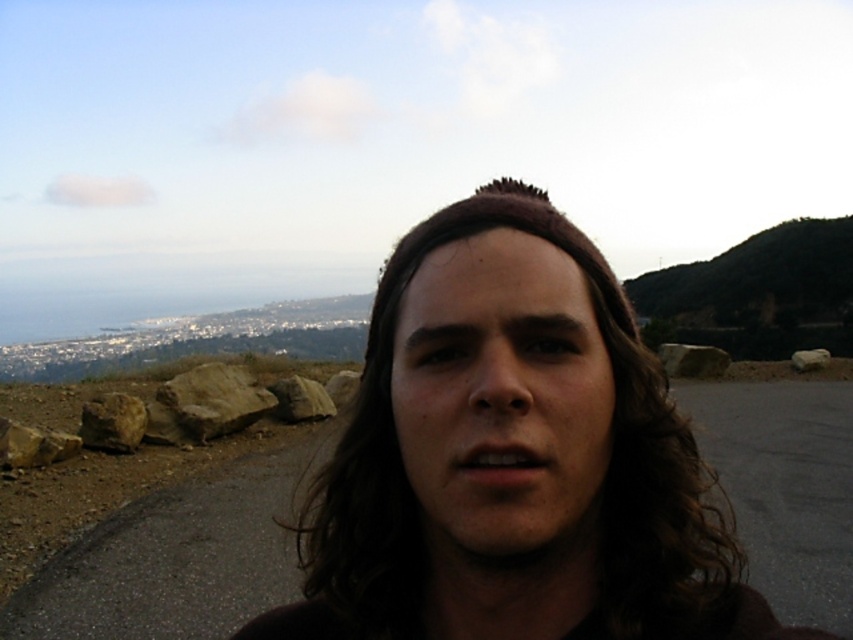
Question: Which of the following is the closest to the observer?

Choices:
 (A) brown rough rock at center
 (B) dirt road at center

Answer: (B)

Question: Is dirt road at center thinner than gray rough rock at right?

Choices:
 (A) yes
 (B) no

Answer: (B)

Question: Which object appears closest to the camera in this image?

Choices:
 (A) brown rough rock at center
 (B) gray rough rock at right
 (C) brown rough rock at lower left
 (D) gray rock at right

Answer: (C)

Question: Observing the image, what is the correct spatial positioning of rough textured rock at left in reference to gray rock at center?

Choices:
 (A) above
 (B) below

Answer: (A)

Question: Does dark green forested hill at upper right appear under brown rough rock at lower left?

Choices:
 (A) yes
 (B) no

Answer: (B)

Question: Among these objects, which one is nearest to the camera?

Choices:
 (A) brown rough rock at center
 (B) dark green forested hill at upper right
 (C) gray rock at center
 (D) brown matte hair at center

Answer: (D)